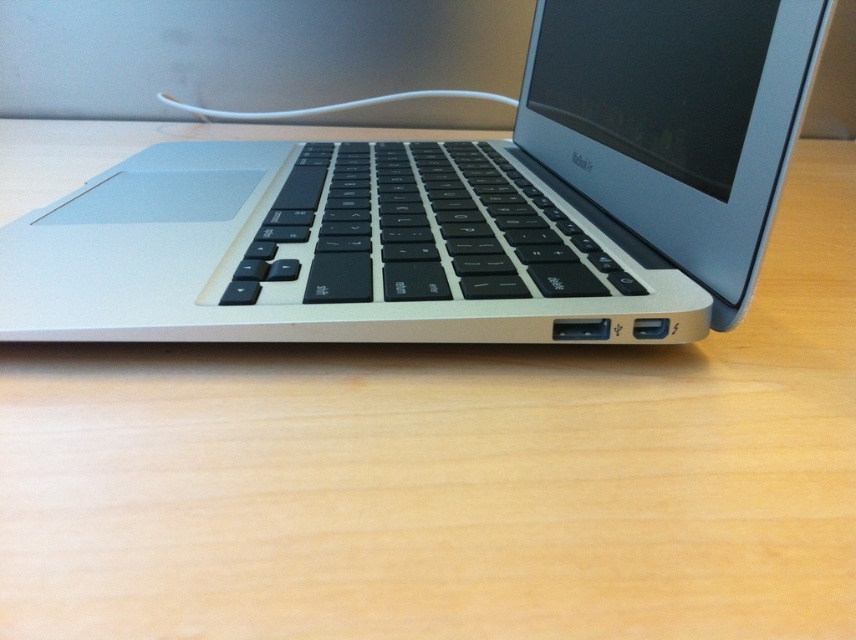
Can you confirm if silver metallic laptop at center is positioned above black matte keyboard at center?

Yes, silver metallic laptop at center is above black matte keyboard at center.

Is point (346, 168) less distant than point (575, 257)?

No, it is not.

Find the location of `silver metallic laptop at center`. silver metallic laptop at center is located at coordinates (456, 204).